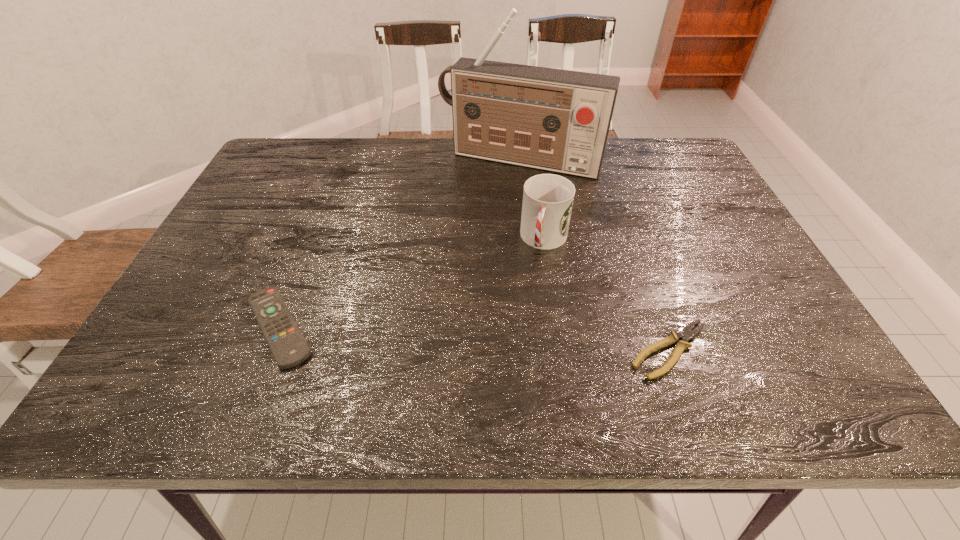
Identify the location of free space on the desktop that is between the third tallest object and the pliers and is positioned on the side of the cup where the handle is located. (513, 341).

Identify the location of vacant space on the desktop that is between the leftmost object and the shortest object and is positioned on the front panel of the radio receiver. (433, 336).